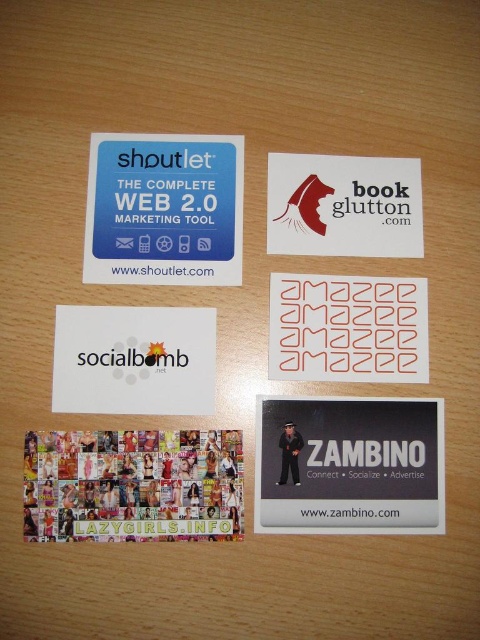
Question: From the image, what is the correct spatial relationship of black matte postcard at lower right in relation to red matte stickers at center?

Choices:
 (A) right
 (B) left

Answer: (A)

Question: Does matte plastic business card at upper left lie in front of white paper at center?

Choices:
 (A) no
 (B) yes

Answer: (A)

Question: Which is farther from the black matte postcard at lower right?

Choices:
 (A) white paper at center
 (B) matte plastic business card at upper left
 (C) red matte stickers at center

Answer: (B)

Question: Which object is closer to the camera taking this photo?

Choices:
 (A) matte plastic business card at upper left
 (B) red matte stickers at center
 (C) multicolored collage at center
 (D) black matte postcard at lower right

Answer: (C)

Question: Is white paper at center to the left of white matte business card at upper center from the viewer's perspective?

Choices:
 (A) no
 (B) yes

Answer: (B)

Question: Which of these objects is positioned farthest from the black matte postcard at lower right?

Choices:
 (A) white paper at center
 (B) matte plastic business card at upper left
 (C) multicolored collage at center

Answer: (B)